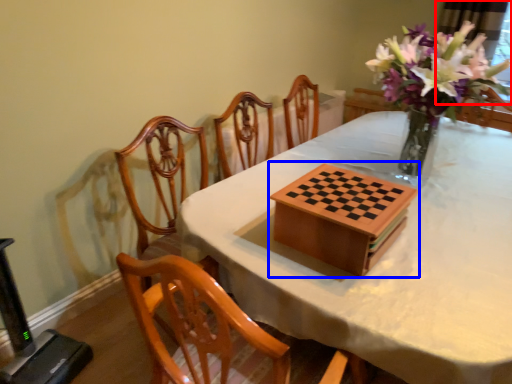
Question: Which point is further to the camera, window screen (highlighted by a red box) or board game (highlighted by a blue box)?

Choices:
 (A) window screen
 (B) board game

Answer: (A)